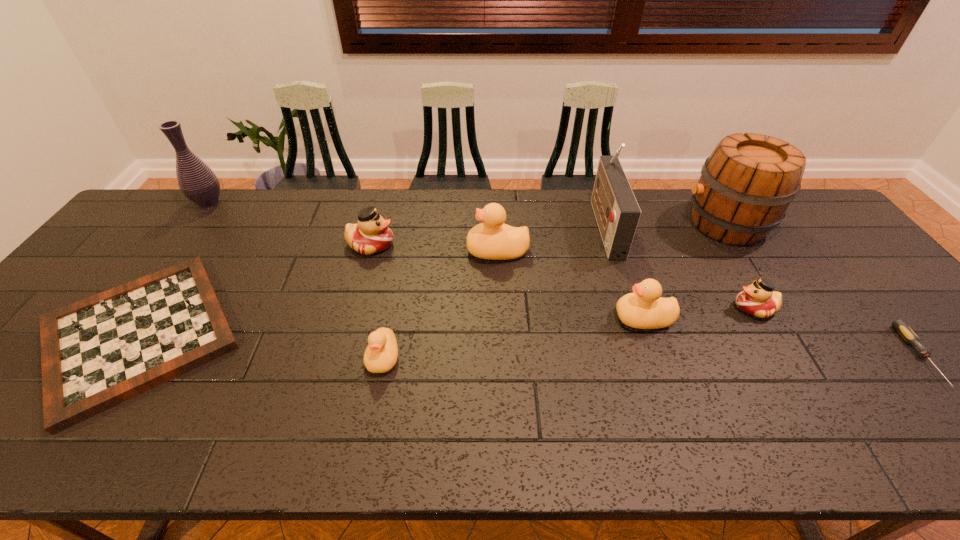
Find the location of a particular element. vase is located at coordinates (196, 180).

Where is `radio receiver`? radio receiver is located at coordinates (617, 213).

Where is `cider`? Image resolution: width=960 pixels, height=540 pixels. cider is located at coordinates (746, 185).

Where is `the second yellow duck from right to left`? This screenshot has height=540, width=960. the second yellow duck from right to left is located at coordinates (492, 239).

This screenshot has height=540, width=960. I want to click on the fourth tallest object, so click(x=492, y=239).

Find the location of `the farther red duck`. the farther red duck is located at coordinates (371, 235).

What are the coordinates of `the bigger red duck` in the screenshot? It's located at (371, 235).

Where is `the second smallest yellow duck`? The height and width of the screenshot is (540, 960). the second smallest yellow duck is located at coordinates (645, 308).

You are a GUI agent. You are given a task and a screenshot of the screen. Output one action in this format:
    pyautogui.click(x=<x>, y=<y>)
    Task: Click on the fourth duck from left to right
    
    Given the screenshot: What is the action you would take?
    tap(645, 308)

At what (x,y) coordinates should I click in order to perform the action: click on the smaller red duck. Please return your answer as a coordinate pair (x, y). Looking at the image, I should click on (758, 299).